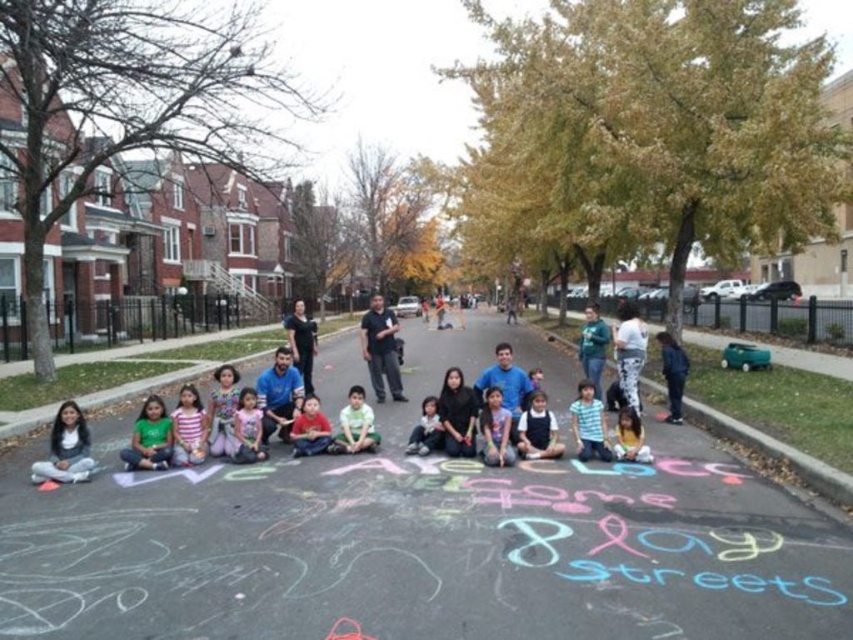
Does light blue uniform at center have a lesser height compared to red shirt at center?

In fact, light blue uniform at center may be taller than red shirt at center.

Between light blue uniform at center and red shirt at center, which one has less height?

red shirt at center is shorter.

I want to click on light blue uniform at center, so click(538, 429).

Locate an element on the screen. The height and width of the screenshot is (640, 853). light blue uniform at center is located at coordinates tap(538, 429).

Does matte white shirt at lower left have a lesser width compared to pink striped shirt at center?

No, matte white shirt at lower left is not thinner than pink striped shirt at center.

How far apart are matte white shirt at lower left and pink striped shirt at center?

4.01 feet

Who is more forward, (39, 468) or (186, 385)?

Point (39, 468) is more forward.

You are a GUI agent. You are given a task and a screenshot of the screen. Output one action in this format:
    pyautogui.click(x=<x>, y=<y>)
    Task: Click on the matte white shirt at lower left
    This screenshot has height=640, width=853.
    Given the screenshot: What is the action you would take?
    pyautogui.click(x=67, y=449)

Who is more distant from viewer, (511, 448) or (645, 448)?

The point (511, 448) is more distant.

The width and height of the screenshot is (853, 640). What do you see at coordinates (495, 429) in the screenshot?
I see `matte green shirt at center` at bounding box center [495, 429].

Find the location of a particular element. matte green shirt at center is located at coordinates (495, 429).